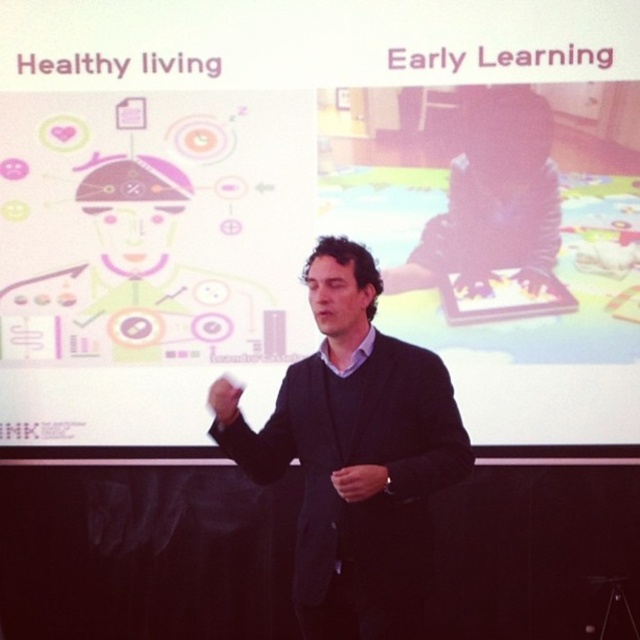
Which is above, white matte projection screen at upper center or dark blue suit at center?

Positioned higher is white matte projection screen at upper center.

Measure the distance between white matte projection screen at upper center and camera.

The distance of white matte projection screen at upper center from camera is 3.13 meters.

Find the location of `white matte projection screen at upper center`. white matte projection screen at upper center is located at coordinates (316, 209).